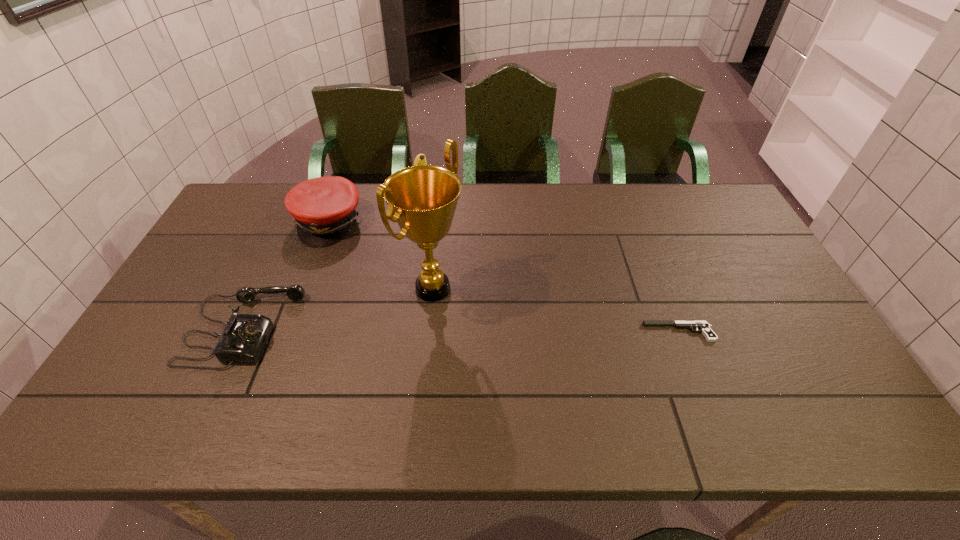
This screenshot has height=540, width=960. Find the location of `vacant space on the desktop that is between the telephone and the rightmost object and is positioned on the front view with handles of the award`. vacant space on the desktop that is between the telephone and the rightmost object and is positioned on the front view with handles of the award is located at coordinates (510, 331).

At what (x,y) coordinates should I click in order to perform the action: click on vacant space on the desktop that is between the telephone and the rightmost object and is positioned from the stem of the fourth shortest object. Please return your answer as a coordinate pair (x, y). Looking at the image, I should click on (493, 330).

Where is `vacant space on the desktop that is between the telephone and the shortest object and is positioned on the front-facing side of the cap`? The width and height of the screenshot is (960, 540). vacant space on the desktop that is between the telephone and the shortest object and is positioned on the front-facing side of the cap is located at coordinates (467, 330).